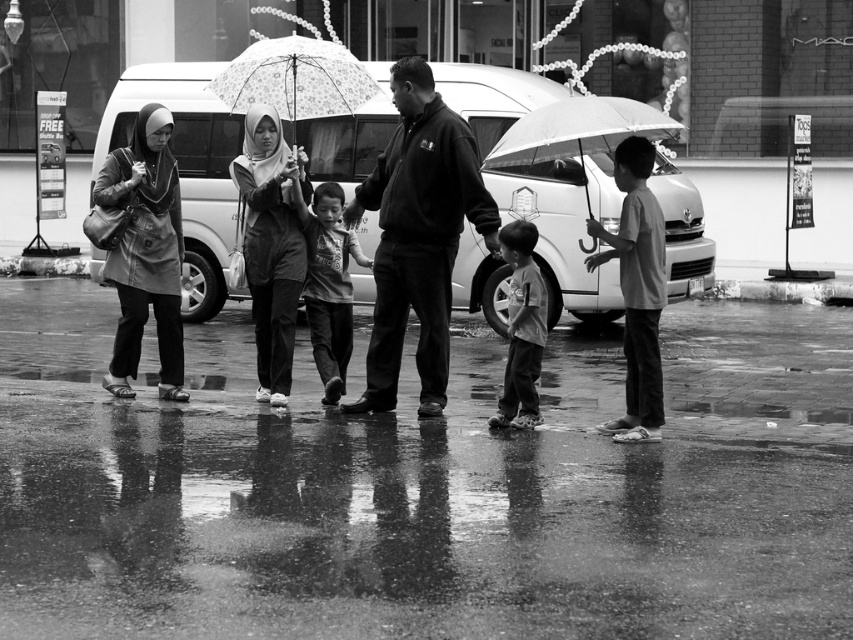
Question: Is matte black hijab at center above light gray cotton shirt at center?

Choices:
 (A) yes
 (B) no

Answer: (A)

Question: Considering the real-world distances, which object is farthest from the dark gray cotton shirt at center?

Choices:
 (A) metallic white van at center
 (B) light gray cotton shirt at center

Answer: (A)

Question: Which point is closer to the camera?

Choices:
 (A) click(244, 96)
 (B) click(157, 189)

Answer: (B)

Question: Which object appears closest to the camera in this image?

Choices:
 (A) matte gray coat at left
 (B) dark gray cotton shirt at center
 (C) metallic white van at center
 (D) light gray cotton shirt at right

Answer: (D)

Question: Does wet asphalt pavement at center have a larger size compared to metallic white van at center?

Choices:
 (A) no
 (B) yes

Answer: (A)

Question: Can you confirm if matte gray coat at left is positioned below light gray cotton shirt at center?

Choices:
 (A) no
 (B) yes

Answer: (A)